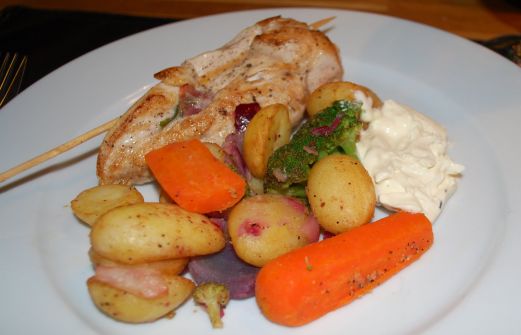
This screenshot has height=335, width=521. Identify the location of white dinner plate. (439, 271).